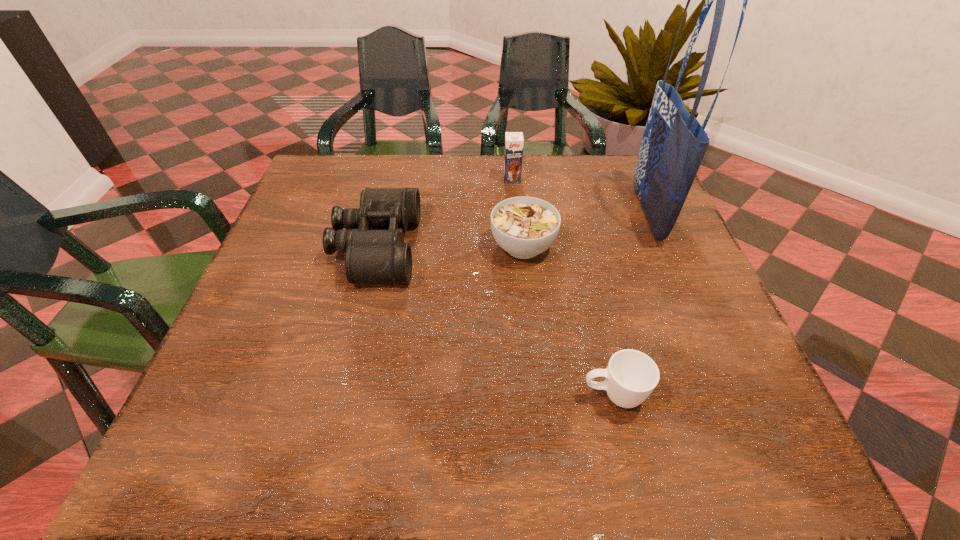
Locate an element on the screen. vacant point that satisfies the following two spatial constraints: 1. on the front label of the chocolate milk; 2. at the eyepieces of the leftmost object is located at coordinates (518, 247).

Identify the location of free space that satisfies the following two spatial constraints: 1. on the front label of the soup bowl; 2. on the right side of the chocolate milk. Image resolution: width=960 pixels, height=540 pixels. [x=518, y=246].

Identify the location of free space that satisfies the following two spatial constraints: 1. on the front label of the chocolate milk; 2. at the eyepieces of the leftmost object. Image resolution: width=960 pixels, height=540 pixels. (518, 247).